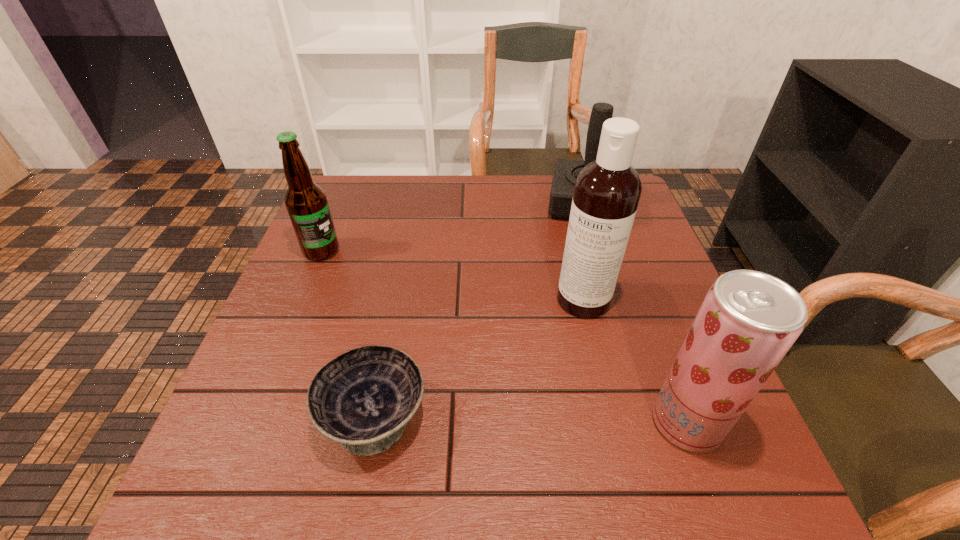
What are the coordinates of `free space located 0.280m on the label side of the dishwasher detergent` in the screenshot? It's located at (528, 424).

This screenshot has width=960, height=540. I want to click on vacant space located on the label side of the dishwasher detergent, so click(566, 337).

You are a GUI agent. You are given a task and a screenshot of the screen. Output one action in this format:
    pyautogui.click(x=<x>, y=<y>)
    Task: Click on the free spot located 0.050m on the label side of the dishwasher detergent
    The image size is (960, 540).
    Given the screenshot: What is the action you would take?
    pyautogui.click(x=568, y=334)

Locate an element on the screen. vacant area located on the base of the joystick is located at coordinates (580, 323).

Find the location of a particular element. free region located 0.220m on the base of the joystick is located at coordinates (582, 282).

In order to click on vacant area located on the base of the joystick in this screenshot , I will do `click(583, 246)`.

This screenshot has width=960, height=540. Identify the location of vacant space located 0.220m on the label of the leftmost object. (388, 301).

At what (x,y) coordinates should I click in order to perform the action: click on vacant space located 0.170m on the label of the leftmost object. Please return your answer as a coordinate pair (x, y). Looking at the image, I should click on (374, 291).

Where is `free region located 0.270m on the label of the leftmost object`? free region located 0.270m on the label of the leftmost object is located at coordinates (402, 313).

Locate an element on the screen. object positioned at the far edge is located at coordinates (566, 171).